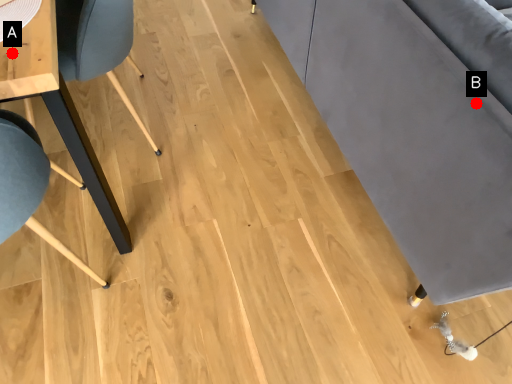
Question: Two points are circled on the image, labeled by A and B beside each circle. Among these points, which one is nearest to the camera?

Choices:
 (A) A is closer
 (B) B is closer

Answer: (B)